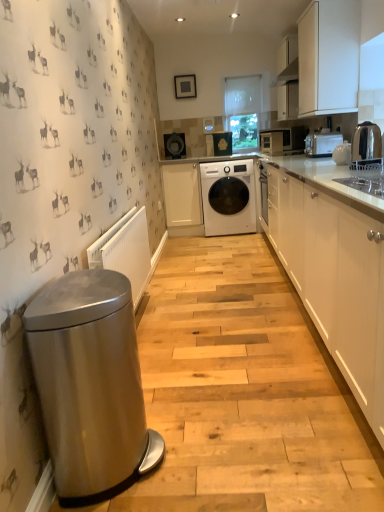
Locate an element on the screen. The width and height of the screenshot is (384, 512). free area behind white plastic radiator at lower left is located at coordinates (190, 289).